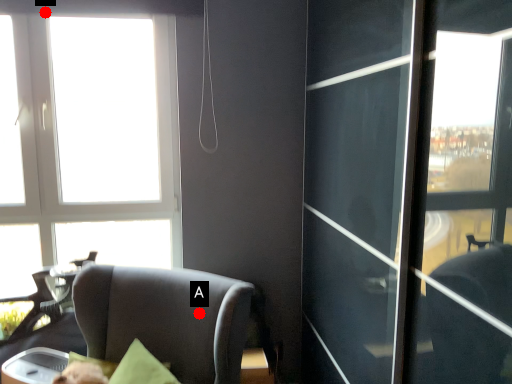
Question: Two points are circled on the image, labeled by A and B beside each circle. Among these points, which one is farthest from the camera?

Choices:
 (A) A is further
 (B) B is further

Answer: (B)